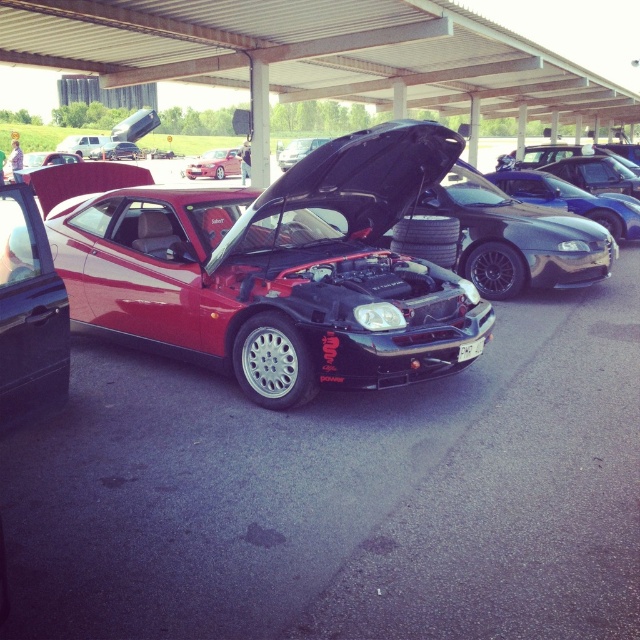
You are standing at the red sports car with its hood open and want to walk towards the point at the bottom of the image. Which point, point at coordinates (280, 154) or point at coordinates (115, 154), is closer to the front of the image?

Point at coordinates (115, 154) is closer to the front of the image because it is behind point at coordinates (280, 154), which is in front of it.

You are a parking assistant who needs to move a 15 meter long truck into the space between the glossy black car at center and the matte black car at center. Is there enough space for the truck to fit between them?

The distance between the glossy black car at center and the matte black car at center is 15.15 meters. Since the truck is 15 meters long, there is enough space for the truck to fit between them as the distance is slightly longer than the truck.

You are at a car meet and want to park your compact car between the shiny metallic car at center and the glossy black car at center. Given that your car is 1.8 meters wide, can you fit it there?

The shiny metallic car at center is thinner than glossy black car at center. The space between them would depend on their widths. Since the shiny metallic car is thinner, the total space between them might be sufficient. However, without exact measurements, it is uncertain. Please check the actual space available.